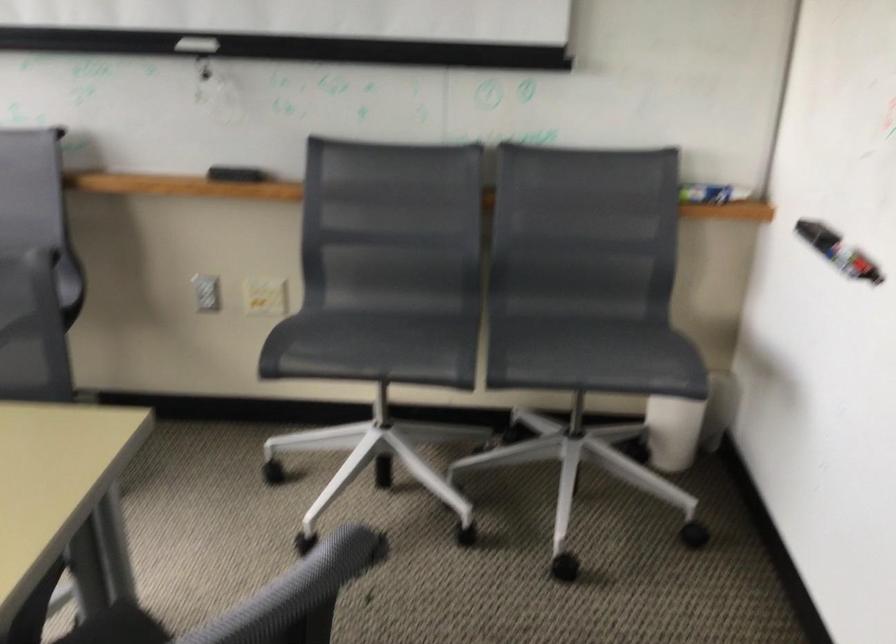
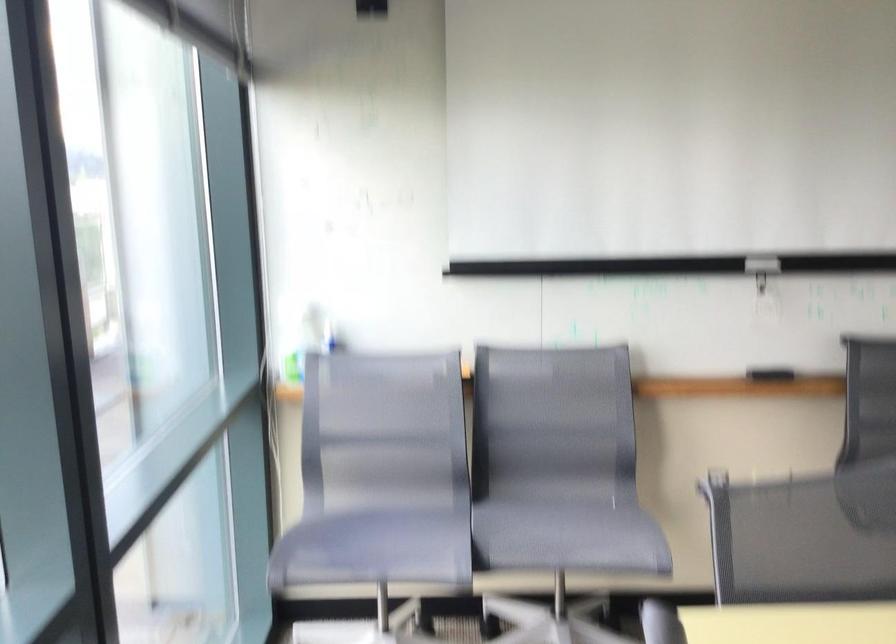
Question: What movement of the cameraman would produce the second image?

Choices:
 (A) Left
 (B) Right
 (C) Forward
 (D) Backward

Answer: (A)